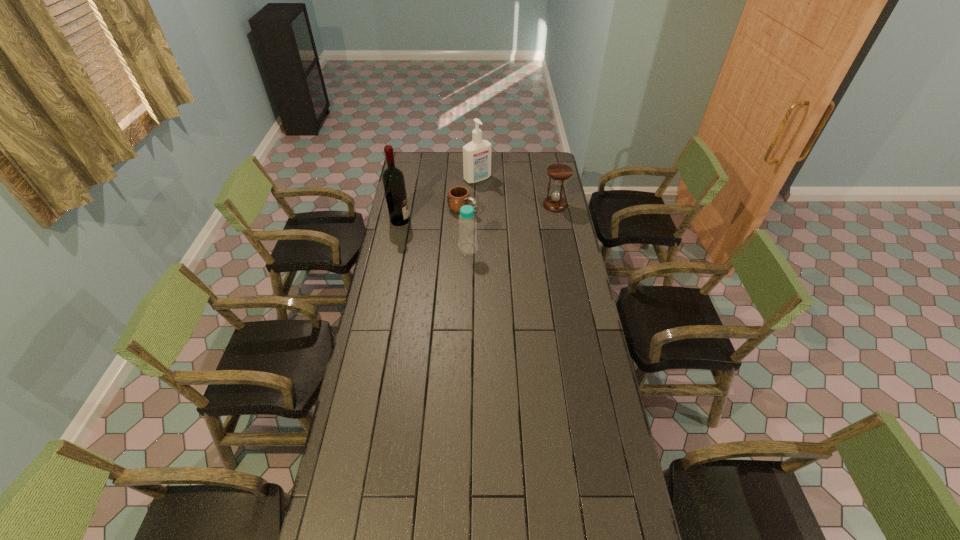
What are the coordinates of `free space at the near edge` in the screenshot? It's located at (537, 530).

Identify the location of vacant point at the left edge. The height and width of the screenshot is (540, 960). (383, 274).

In order to click on vacant space at the right edge in this screenshot , I will do `click(583, 488)`.

You are a GUI agent. You are given a task and a screenshot of the screen. Output one action in this format:
    pyautogui.click(x=<x>, y=<y>)
    Task: Click on the unoccupied position between the hourglass and the nearest object
    The image size is (960, 540).
    Given the screenshot: What is the action you would take?
    pyautogui.click(x=512, y=227)

At what (x,y) coordinates should I click in order to perform the action: click on unoccupied position between the bottle and the rightmost object. Please return your answer as a coordinate pair (x, y). The image size is (960, 540). Looking at the image, I should click on (512, 227).

In order to click on vacant area between the leftmost object and the hourglass in this screenshot , I will do pos(477,213).

The width and height of the screenshot is (960, 540). I want to click on free spot between the nearest object and the leftmost object, so click(434, 234).

Image resolution: width=960 pixels, height=540 pixels. Find the location of `free space between the shortest object and the farthest object`. free space between the shortest object and the farthest object is located at coordinates (470, 194).

This screenshot has width=960, height=540. Find the location of `blank region between the fourth shortest object and the leftmost object`. blank region between the fourth shortest object and the leftmost object is located at coordinates tap(439, 200).

This screenshot has height=540, width=960. I want to click on unoccupied area between the mug and the alcohol, so click(x=431, y=215).